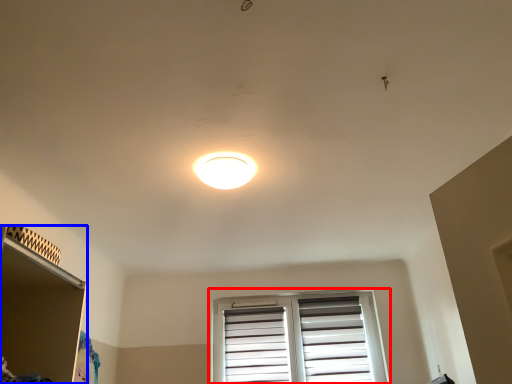
Question: Which object is further to the camera taking this photo, window (highlighted by a red box) or shelf (highlighted by a blue box)?

Choices:
 (A) window
 (B) shelf

Answer: (A)